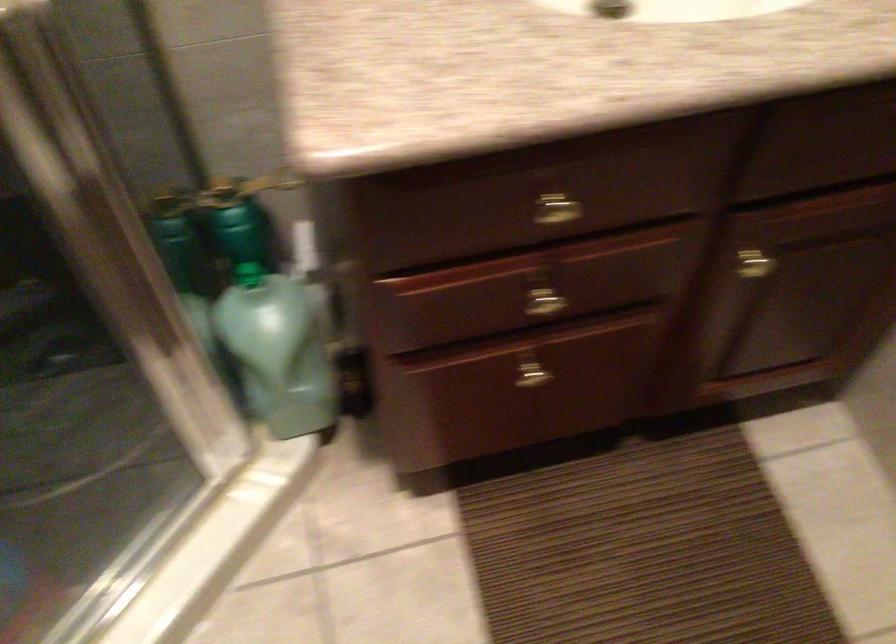
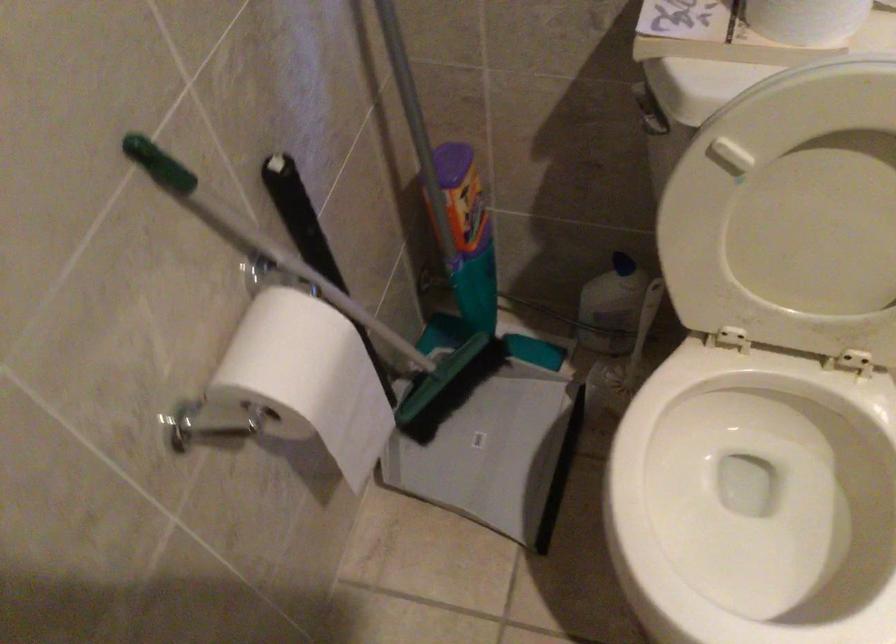
How did the camera likely rotate?

The camera rotated toward left-down.